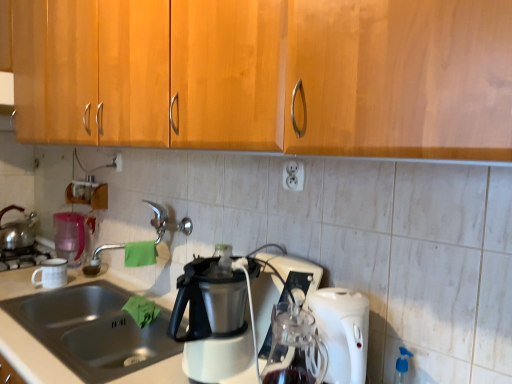
Question: In terms of width, does stainless steel sink at lower left look wider or thinner when compared to blue translucent spray bottle at lower right?

Choices:
 (A) thin
 (B) wide

Answer: (B)

Question: Is stainless steel sink at lower left taller or shorter than blue translucent spray bottle at lower right?

Choices:
 (A) short
 (B) tall

Answer: (B)

Question: Considering the real-world distances, which object is closest to the blue translucent spray bottle at lower right?

Choices:
 (A) metallic white coffee maker at center
 (B) satin nickel faucet at center
 (C) stainless steel sink at lower left
 (D) shiny metallic kettle at left
 (E) white plastic electric outlet at center, the 2th electric outlet positioned from the top

Answer: (A)

Question: Which object is positioned closest to the blue translucent spray bottle at lower right?

Choices:
 (A) pink plastic pitcher at left
 (B) white matte coffee cup at left
 (C) satin nickel faucet at center
 (D) white plastic electric outlet at upper center, positioned as the 2th electric outlet in right-to-left order
 (E) white plastic electric outlet at center, positioned as the first electric outlet in right-to-left order

Answer: (E)